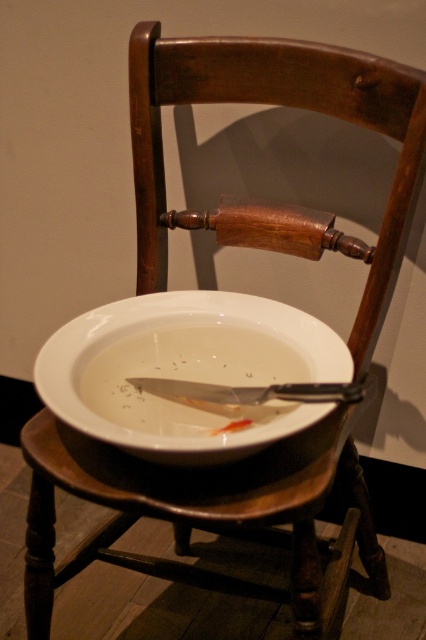
Question: Is wooden stool at center smaller than white glossy soup bowl at center?

Choices:
 (A) yes
 (B) no

Answer: (B)

Question: Is wooden stool at center positioned in front of shiny silver knife at center?

Choices:
 (A) no
 (B) yes

Answer: (B)

Question: Observing the image, what is the correct spatial positioning of wooden stool at center in reference to shiny silver knife at center?

Choices:
 (A) left
 (B) right

Answer: (B)

Question: Which point is closer to the camera taking this photo?

Choices:
 (A) (45, 579)
 (B) (325, 413)
 (C) (242, 392)

Answer: (B)

Question: Which object is closer to the camera taking this photo?

Choices:
 (A) wooden stool at center
 (B) shiny silver knife at center
 (C) white glossy soup bowl at center

Answer: (C)

Question: Which point is closer to the camera taking this photo?

Choices:
 (A) (x=311, y=385)
 (B) (x=222, y=314)
 (C) (x=43, y=467)

Answer: (A)